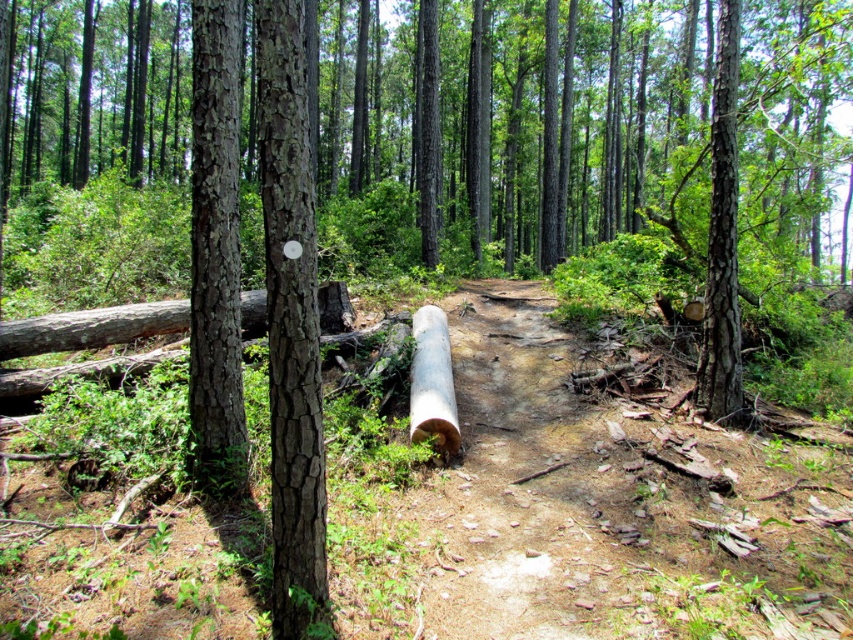
Question: Which point is closer to the camera taking this photo?

Choices:
 (A) (729, 314)
 (B) (451, 456)
 (C) (419, 397)

Answer: (B)

Question: Where is smooth wood log at center located in relation to smooth gray log at center in the image?

Choices:
 (A) right
 (B) left

Answer: (A)

Question: Is brown rough bark tree trunk at right above smooth gray log at center?

Choices:
 (A) yes
 (B) no

Answer: (A)

Question: Can you confirm if smooth brown bark at center is bigger than smooth gray log at center?

Choices:
 (A) yes
 (B) no

Answer: (B)

Question: Which is nearer to the smooth gray log at center?

Choices:
 (A) brown rough bark tree trunk at right
 (B) smooth brown bark at center
 (C) smooth wood log at center
 (D) brown rough bark tree trunk at center

Answer: (C)

Question: Which point is closer to the camera taking this photo?

Choices:
 (A) (720, 141)
 (B) (202, 243)
 (C) (427, 332)
 (D) (312, 432)

Answer: (D)